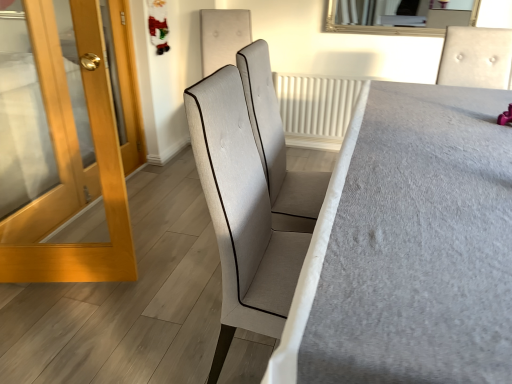
Describe the element at coordinates (476, 57) in the screenshot. This screenshot has width=512, height=384. I see `light gray fabric chair at upper right, the first chair in the back-to-front sequence` at that location.

The width and height of the screenshot is (512, 384). Describe the element at coordinates (276, 139) in the screenshot. I see `light gray fabric chair at center, marked as the 2th chair in a back-to-front arrangement` at that location.

What is the approximate width of textured fabric chair at center?

3.45 feet.

Identify the location of wooden glossy door at left. (58, 144).

Can you confirm if textured fabric chair at center is bigger than light gray fabric chair at upper right, placed as the 1th chair when sorted from right to left?

Yes.

Looking at this image, considering the positions of objects textured fabric chair at center and light gray fabric chair at upper right, arranged as the 2th chair when viewed from the front, in the image provided, who is more to the right, textured fabric chair at center or light gray fabric chair at upper right, arranged as the 2th chair when viewed from the front,?

From the viewer's perspective, light gray fabric chair at upper right, arranged as the 2th chair when viewed from the front, appears more on the right side.

Is textured fabric chair at center placed right next to light gray fabric chair at upper right, placed as the 1th chair when sorted from right to left?

No, textured fabric chair at center is not in contact with light gray fabric chair at upper right, placed as the 1th chair when sorted from right to left.

Is textured fabric chair at center wider than light gray fabric chair at upper right, which is the 2th chair from left to right?

Yes.

From a real-world perspective, is textured fabric chair at center below light gray fabric chair at center, which is the second chair from right to left?

Correct, in the physical world, textured fabric chair at center is lower than light gray fabric chair at center, which is the second chair from right to left.

Between textured fabric chair at center and light gray fabric chair at center, which ranks as the 1th chair in front-to-back order, which one has larger width?

With larger width is textured fabric chair at center.

Is the depth of textured fabric chair at center greater than that of light gray fabric chair at center, the first chair positioned from the left?

No, textured fabric chair at center is closer to the camera.

Is textured fabric chair at center at the right side of light gray fabric chair at center, marked as the 2th chair in a back-to-front arrangement?

Yes.

Considering the sizes of objects light gray fabric chair at center, which is the second chair from right to left, and light gray fabric chair at upper right, arranged as the 2th chair when viewed from the front, in the image provided, who is thinner, light gray fabric chair at center, which is the second chair from right to left, or light gray fabric chair at upper right, arranged as the 2th chair when viewed from the front,?

With smaller width is light gray fabric chair at upper right, arranged as the 2th chair when viewed from the front.

Based on the photo, is light gray fabric chair at center, which ranks as the 1th chair in front-to-back order, facing towards light gray fabric chair at upper right, which is the 2th chair from left to right?

No, light gray fabric chair at center, which ranks as the 1th chair in front-to-back order, does not turn towards light gray fabric chair at upper right, which is the 2th chair from left to right.

Is light gray fabric chair at center, marked as the 2th chair in a back-to-front arrangement, closer to camera compared to light gray fabric chair at upper right, arranged as the 2th chair when viewed from the front?

Yes, light gray fabric chair at center, marked as the 2th chair in a back-to-front arrangement, is closer to the camera.

Consider the image. From the image's perspective, is light gray fabric chair at center, marked as the 2th chair in a back-to-front arrangement, beneath light gray fabric chair at upper right, placed as the 1th chair when sorted from right to left?

Indeed, from the image's perspective, light gray fabric chair at center, marked as the 2th chair in a back-to-front arrangement, is shown beneath light gray fabric chair at upper right, placed as the 1th chair when sorted from right to left.

Is light gray fabric chair at upper right, placed as the 1th chair when sorted from right to left, bigger or smaller than textured fabric chair at center?

In the image, light gray fabric chair at upper right, placed as the 1th chair when sorted from right to left, appears to be smaller than textured fabric chair at center.

Consider the image. Could you tell me if light gray fabric chair at upper right, the first chair in the back-to-front sequence, is turned towards textured fabric chair at center?

Yes, light gray fabric chair at upper right, the first chair in the back-to-front sequence, is turned towards textured fabric chair at center.

From the picture: Are light gray fabric chair at upper right, arranged as the 2th chair when viewed from the front, and textured fabric chair at center far apart?

light gray fabric chair at upper right, arranged as the 2th chair when viewed from the front, is actually quite close to textured fabric chair at center.

Choose the correct answer: Is light gray fabric chair at upper right, the first chair in the back-to-front sequence, inside textured fabric chair at center or outside it?

The correct answer is: outside.

Could silver-framed mirror at upper center be considered to be inside light gray fabric chair at center, marked as the 2th chair in a back-to-front arrangement?

No, silver-framed mirror at upper center is located outside of light gray fabric chair at center, marked as the 2th chair in a back-to-front arrangement.

Measure the distance between light gray fabric chair at center, which is the second chair from right to left, and silver-framed mirror at upper center.

1.76 meters.

From a real-world perspective, between light gray fabric chair at center, which ranks as the 1th chair in front-to-back order, and silver-framed mirror at upper center, who is vertically higher?

From a 3D spatial view, silver-framed mirror at upper center is above.

Is silver-framed mirror at upper center taller or shorter than light gray fabric chair at center, the first chair positioned from the left?

Considering their sizes, silver-framed mirror at upper center has less height than light gray fabric chair at center, the first chair positioned from the left.

From a real-world perspective, which object rests below the other?

light gray fabric chair at center, which ranks as the 1th chair in front-to-back order.

Between silver-framed mirror at upper center and light gray fabric chair at center, marked as the 2th chair in a back-to-front arrangement, which one has larger size?

light gray fabric chair at center, marked as the 2th chair in a back-to-front arrangement.

Is silver-framed mirror at upper center placed right next to light gray fabric chair at center, which is the second chair from right to left?

No, silver-framed mirror at upper center is not making contact with light gray fabric chair at center, which is the second chair from right to left.

Does textured fabric chair at center have a lesser height compared to wooden glossy door at left?

Yes.

From the image's perspective, is textured fabric chair at center located above wooden glossy door at left?

Incorrect, from the image's perspective, textured fabric chair at center is lower than wooden glossy door at left.

Does point (362, 294) lie in front of point (56, 6)?

That is True.

Looking at their sizes, would you say textured fabric chair at center is wider or thinner than wooden glossy door at left?

Considering their sizes, textured fabric chair at center looks broader than wooden glossy door at left.

I want to click on furniture below the light gray fabric chair at upper right, which is the 2th chair from left to right (from a real-world perspective), so (x=409, y=247).

Which chair is the 1st one when counting from the back of the textured fabric chair at center? Please provide its 2D coordinates.

[(276, 139)]

Considering their positions, is wooden glossy door at left positioned further to light gray fabric chair at upper right, the first chair in the back-to-front sequence, than silver-framed mirror at upper center?

Based on the image, wooden glossy door at left appears to be further to light gray fabric chair at upper right, the first chair in the back-to-front sequence.

Estimate the real-world distances between objects in this image. Which object is further from textured fabric chair at center, light gray fabric chair at center, which is the second chair from right to left, or light gray fabric chair at upper right, arranged as the 2th chair when viewed from the front?

Based on the image, light gray fabric chair at upper right, arranged as the 2th chair when viewed from the front, appears to be further to textured fabric chair at center.

Looking at the image, which one is located closer to wooden glossy door at left, light gray fabric chair at center, marked as the 2th chair in a back-to-front arrangement, or light gray fabric chair at upper right, the first chair in the back-to-front sequence?

The object closer to wooden glossy door at left is light gray fabric chair at center, marked as the 2th chair in a back-to-front arrangement.

Which object lies nearer to the anchor point silver-framed mirror at upper center, light gray fabric chair at upper right, arranged as the 2th chair when viewed from the front, or wooden glossy door at left?

light gray fabric chair at upper right, arranged as the 2th chair when viewed from the front, is positioned closer to the anchor silver-framed mirror at upper center.

Looking at the image, which one is located further to silver-framed mirror at upper center, textured fabric chair at center or light gray fabric chair at upper right, arranged as the 2th chair when viewed from the front?

textured fabric chair at center is further to silver-framed mirror at upper center.

When comparing their distances from light gray fabric chair at upper right, arranged as the 2th chair when viewed from the front, does silver-framed mirror at upper center or wooden glossy door at left seem further?

Among the two, wooden glossy door at left is located further to light gray fabric chair at upper right, arranged as the 2th chair when viewed from the front.

Estimate the real-world distances between objects in this image. Which object is further from light gray fabric chair at upper right, arranged as the 2th chair when viewed from the front, textured fabric chair at center or wooden glossy door at left?

wooden glossy door at left lies further to light gray fabric chair at upper right, arranged as the 2th chair when viewed from the front, than the other object.

In the scene shown: Considering their positions, is textured fabric chair at center positioned closer to wooden glossy door at left than silver-framed mirror at upper center?

textured fabric chair at center is positioned closer to the anchor wooden glossy door at left.

The image size is (512, 384). What are the coordinates of `mirror between wooden glossy door at left and light gray fabric chair at upper right, arranged as the 2th chair when viewed from the front, in the horizontal direction` in the screenshot? It's located at (399, 16).

You are a GUI agent. You are given a task and a screenshot of the screen. Output one action in this format:
    pyautogui.click(x=<x>, y=<y>)
    Task: Click on the chair between wooden glossy door at left and textured fabric chair at center
    
    Given the screenshot: What is the action you would take?
    pyautogui.click(x=276, y=139)

The height and width of the screenshot is (384, 512). I want to click on chair positioned between textured fabric chair at center and light gray fabric chair at upper right, placed as the 1th chair when sorted from right to left, from near to far, so click(276, 139).

The height and width of the screenshot is (384, 512). Identify the location of furniture situated between wooden glossy door at left and light gray fabric chair at upper right, the first chair in the back-to-front sequence, from left to right. (409, 247).